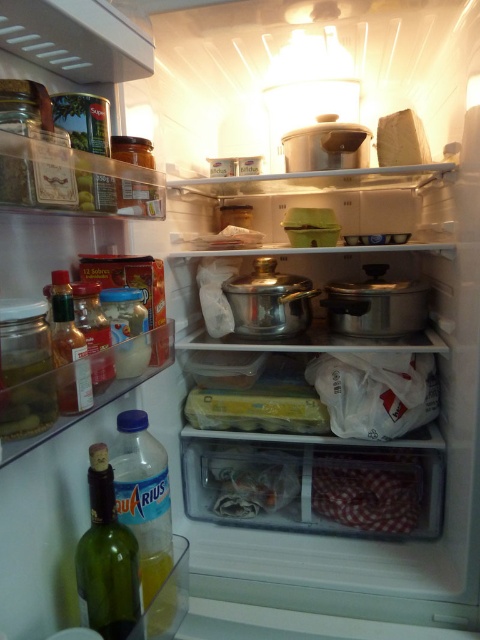
You are organizing items in the refrigerator and need to place a new item at point (107, 557). What object is currently occupying that location?

The green glass bottle at lower left is located at point (107, 557).